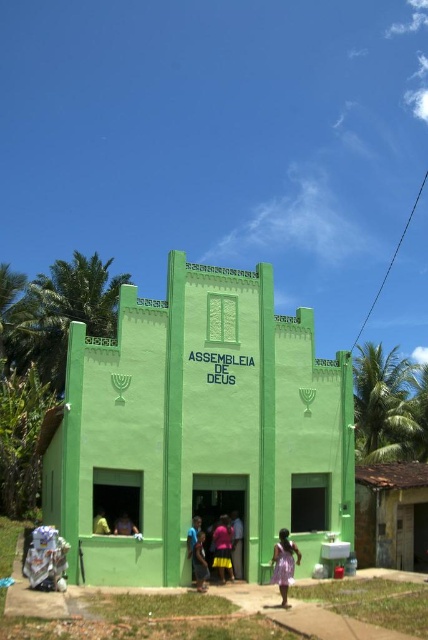
Does point (290, 582) lie in front of point (134, 532)?

Yes, point (290, 582) is in front of point (134, 532).

What do you see at coordinates (284, 563) in the screenshot?
I see `purple satin dress at lower center` at bounding box center [284, 563].

Find the location of a particular element. purple satin dress at lower center is located at coordinates (284, 563).

Does point (121, 524) come behind point (104, 513)?

No, it is not.

Does point (119, 534) lie in front of point (95, 524)?

No, (119, 534) is further to viewer.

I want to click on yellow fabric at lower left, so click(x=124, y=525).

Does pink fabric skirt at center have a greater height compared to yellow fabric at lower left?

Correct, pink fabric skirt at center is much taller as yellow fabric at lower left.

Can you confirm if pink fabric skirt at center is shorter than yellow fabric at lower left?

No.

Is point (228, 534) positioned in front of point (121, 515)?

No.

Where is `pink fabric skirt at center`? pink fabric skirt at center is located at coordinates (222, 548).